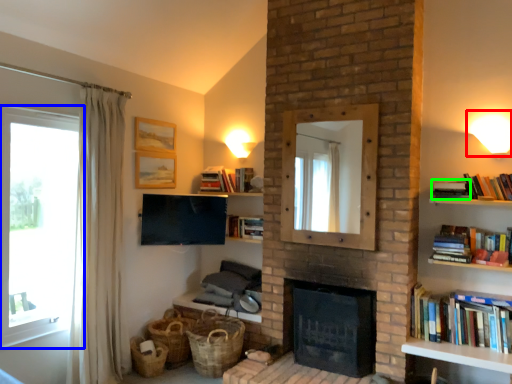
Question: Which is farther away from light fixture (highlighted by a red box)? window (highlighted by a blue box) or book (highlighted by a green box)?

Choices:
 (A) window
 (B) book

Answer: (A)